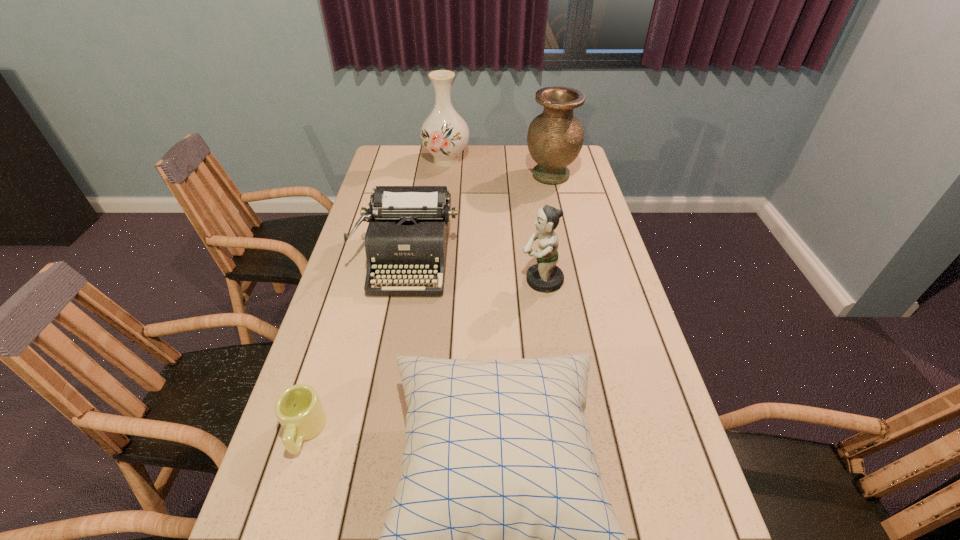
Locate an element on the screen. The height and width of the screenshot is (540, 960). blank region between the shortest object and the right vase is located at coordinates (427, 303).

I want to click on empty space between the left vase and the right vase, so click(x=498, y=168).

Identify the location of free space between the figurine and the mug. (422, 356).

In order to click on object that can be found as the fourth closest to the shortest object in this screenshot , I will do `click(444, 133)`.

Find the location of a particular element. The image size is (960, 540). the second closest object to the mug is located at coordinates (407, 235).

I want to click on blank area in the image that satisfies the following two spatial constraints: 1. on the front side of the left vase; 2. on the right side of the right vase, so click(x=444, y=176).